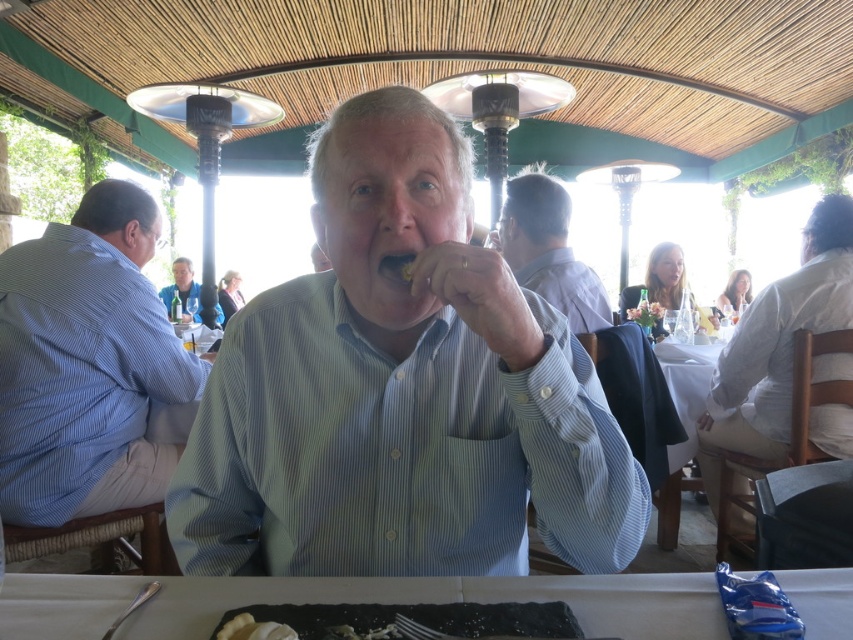
How much distance is there between blue striped shirt at left and blue shirt at center?

blue striped shirt at left and blue shirt at center are 7.10 feet apart.

Does blue striped shirt at left have a larger size compared to blue shirt at center?

Incorrect, blue striped shirt at left is not larger than blue shirt at center.

Based on the photo, who is more forward, (30,276) or (190,285)?

Positioned in front is point (30,276).

You are a GUI agent. You are given a task and a screenshot of the screen. Output one action in this format:
    pyautogui.click(x=<x>, y=<y>)
    Task: Click on the blue striped shirt at left
    The image size is (853, 640).
    Given the screenshot: What is the action you would take?
    pyautogui.click(x=90, y=365)

Can you confirm if light blue striped shirt at center is taller than matte blue shirt at upper center?

Yes, light blue striped shirt at center is taller than matte blue shirt at upper center.

Which is behind, point (554, 353) or point (537, 228)?

Point (537, 228)

Is point (451, 404) positioned in front of point (550, 221)?

Yes, point (451, 404) is in front of point (550, 221).

Where is `light blue striped shirt at center`? This screenshot has width=853, height=640. light blue striped shirt at center is located at coordinates (401, 392).

Is matte blue shirt at upper center wider than yellow crumbly food at mouth?

Yes, matte blue shirt at upper center is wider than yellow crumbly food at mouth.

Locate an element on the screen. The height and width of the screenshot is (640, 853). matte blue shirt at upper center is located at coordinates (549, 252).

Is point (543, 236) farther from viewer compared to point (407, 269)?

Yes, point (543, 236) is behind point (407, 269).

I want to click on matte blue shirt at upper center, so click(549, 252).